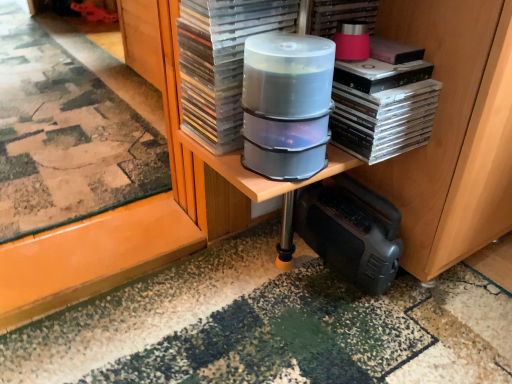
Question: Considering the relative positions of transparent plastic case at center, marked as the second paperback book in a right-to-left arrangement, and clear plastic cd cases at center in the image provided, is transparent plastic case at center, marked as the second paperback book in a right-to-left arrangement, to the right of clear plastic cd cases at center from the viewer's perspective?

Choices:
 (A) no
 (B) yes

Answer: (A)

Question: Considering the relative sizes of transparent plastic case at center, marked as the second paperback book in a right-to-left arrangement, and clear plastic cd cases at center in the image provided, is transparent plastic case at center, marked as the second paperback book in a right-to-left arrangement, shorter than clear plastic cd cases at center?

Choices:
 (A) yes
 (B) no

Answer: (B)

Question: Can you confirm if transparent plastic case at center, marked as the second paperback book in a right-to-left arrangement, is wider than clear plastic cd cases at center?

Choices:
 (A) yes
 (B) no

Answer: (A)

Question: Considering the relative sizes of transparent plastic case at center, marked as the second paperback book in a right-to-left arrangement, and clear plastic cd cases at center in the image provided, is transparent plastic case at center, marked as the second paperback book in a right-to-left arrangement, bigger than clear plastic cd cases at center?

Choices:
 (A) yes
 (B) no

Answer: (A)

Question: Is transparent plastic case at center, marked as the second paperback book in a right-to-left arrangement, facing away from clear plastic cd cases at center?

Choices:
 (A) no
 (B) yes

Answer: (A)

Question: Relative to clear plastic cd cases at center, is clear plastic container at center, arranged as the 2th appliance when ordered from the bottom, in front or behind?

Choices:
 (A) behind
 (B) front

Answer: (B)

Question: Is point (274, 99) positioned closer to the camera than point (375, 119)?

Choices:
 (A) farther
 (B) closer

Answer: (B)

Question: From the image's perspective, relative to clear plastic cd cases at center, is clear plastic container at center, positioned as the first appliance in front-to-back order, above or below?

Choices:
 (A) below
 (B) above

Answer: (A)

Question: Looking at their shapes, would you say clear plastic container at center, positioned as the first appliance in front-to-back order, is wider or thinner than clear plastic cd cases at center?

Choices:
 (A) thin
 (B) wide

Answer: (A)

Question: Considering their positions, is pink matte paperback book at upper right, the second paperback book when ordered from left to right, located in front of or behind black plastic speaker at lower right, marked as the 1th appliance in a bottom-to-top arrangement?

Choices:
 (A) front
 (B) behind

Answer: (A)

Question: From a real-world perspective, relative to black plastic speaker at lower right, placed as the 2th appliance when sorted from top to bottom, is pink matte paperback book at upper right, the first paperback book when ordered from right to left, vertically above or below?

Choices:
 (A) above
 (B) below

Answer: (A)

Question: Considering the positions of pink matte paperback book at upper right, the first paperback book when ordered from right to left, and black plastic speaker at lower right, placed as the 2th appliance when sorted from top to bottom, in the image, is pink matte paperback book at upper right, the first paperback book when ordered from right to left, wider or thinner than black plastic speaker at lower right, placed as the 2th appliance when sorted from top to bottom,?

Choices:
 (A) wide
 (B) thin

Answer: (A)

Question: Considering the positions of pink matte paperback book at upper right, the second paperback book when ordered from left to right, and black plastic speaker at lower right, marked as the 1th appliance in a bottom-to-top arrangement, in the image, is pink matte paperback book at upper right, the second paperback book when ordered from left to right, taller or shorter than black plastic speaker at lower right, marked as the 1th appliance in a bottom-to-top arrangement,?

Choices:
 (A) short
 (B) tall

Answer: (A)

Question: From the image's perspective, relative to clear plastic container at center, marked as the 2th appliance in a back-to-front arrangement, is transparent plastic case at center, which is the 1th paperback book in left-to-right order, above or below?

Choices:
 (A) below
 (B) above

Answer: (B)

Question: Is transparent plastic case at center, marked as the second paperback book in a right-to-left arrangement, taller or shorter than clear plastic container at center, marked as the 2th appliance in a back-to-front arrangement?

Choices:
 (A) short
 (B) tall

Answer: (B)